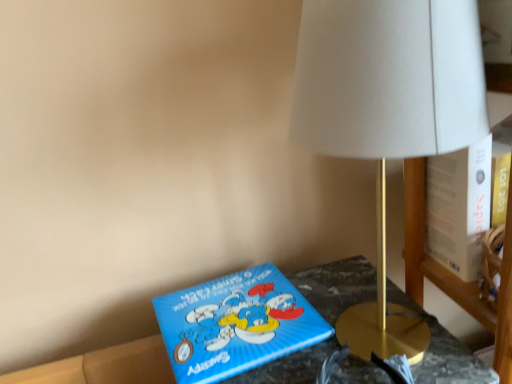
Question: Is gold metallic lamp at upper right aimed at blue cardboard box at lower left?

Choices:
 (A) yes
 (B) no

Answer: (B)

Question: Is gold metallic lamp at upper right to the left of blue cardboard box at lower left from the viewer's perspective?

Choices:
 (A) no
 (B) yes

Answer: (A)

Question: Is gold metallic lamp at upper right not within blue cardboard box at lower left?

Choices:
 (A) no
 (B) yes

Answer: (B)

Question: Is gold metallic lamp at upper right shorter than blue cardboard box at lower left?

Choices:
 (A) no
 (B) yes

Answer: (A)

Question: Would you say gold metallic lamp at upper right contains blue cardboard box at lower left?

Choices:
 (A) yes
 (B) no

Answer: (B)

Question: From the image's perspective, is blue cardboard box at lower left positioned above or below blue matte puzzle box at lower center?

Choices:
 (A) above
 (B) below

Answer: (B)

Question: Do you think blue cardboard box at lower left is within blue matte puzzle box at lower center, or outside of it?

Choices:
 (A) outside
 (B) inside

Answer: (A)

Question: In the image, is blue cardboard box at lower left positioned in front of or behind blue matte puzzle box at lower center?

Choices:
 (A) behind
 (B) front

Answer: (B)

Question: Is blue cardboard box at lower left wider or thinner than blue matte puzzle box at lower center?

Choices:
 (A) wide
 (B) thin

Answer: (A)

Question: Is point (294, 97) closer or farther from the camera than point (267, 299)?

Choices:
 (A) farther
 (B) closer

Answer: (B)

Question: Considering their positions, is gold metallic lamp at upper right located in front of or behind blue matte puzzle box at lower center?

Choices:
 (A) front
 (B) behind

Answer: (A)

Question: From the image's perspective, relative to blue matte puzzle box at lower center, is gold metallic lamp at upper right above or below?

Choices:
 (A) above
 (B) below

Answer: (A)

Question: In terms of size, does gold metallic lamp at upper right appear bigger or smaller than blue matte puzzle box at lower center?

Choices:
 (A) small
 (B) big

Answer: (B)

Question: Do you think blue cardboard box at lower left is within gold metallic lamp at upper right, or outside of it?

Choices:
 (A) outside
 (B) inside

Answer: (A)

Question: Looking at the image, does blue cardboard box at lower left seem bigger or smaller compared to gold metallic lamp at upper right?

Choices:
 (A) big
 (B) small

Answer: (A)